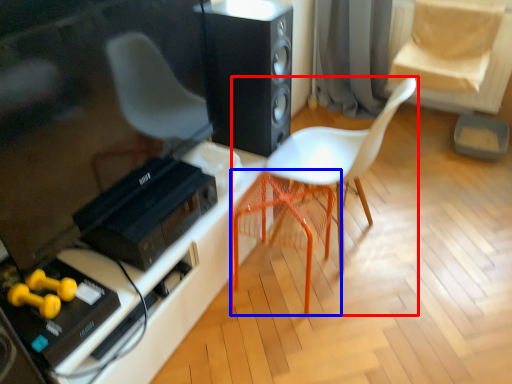
Question: Which object is further to the camera taking this photo, chair (highlighted by a red box) or swivel chair (highlighted by a blue box)?

Choices:
 (A) chair
 (B) swivel chair

Answer: (B)